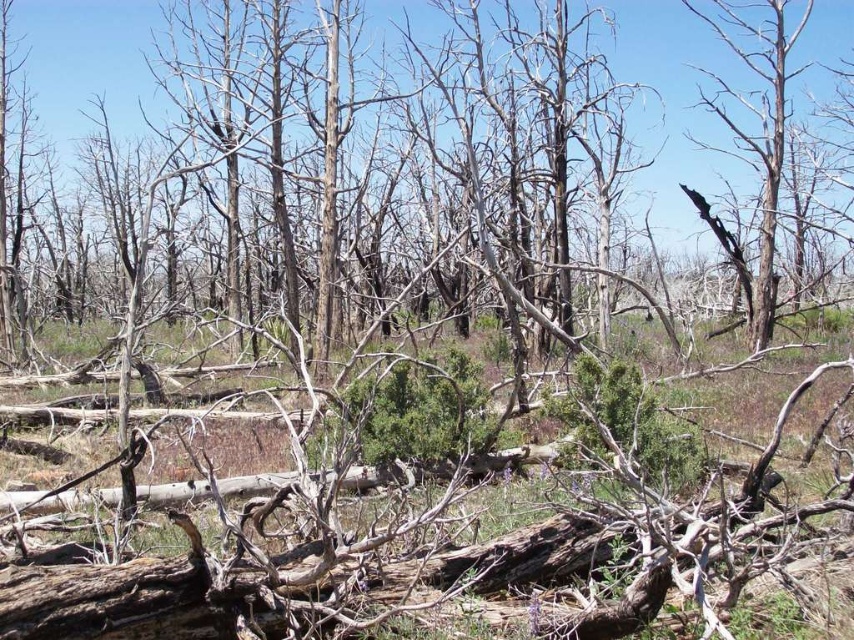
Question: Among these points, which one is farthest from the camera?

Choices:
 (A) (390, 12)
 (B) (773, 173)

Answer: (A)

Question: Where is dead wood at center located in relation to charred wood tree at right in the image?

Choices:
 (A) right
 (B) left

Answer: (B)

Question: Which point is farther to the camera?

Choices:
 (A) charred wood tree at right
 (B) dead wood at center

Answer: (B)

Question: Is dead wood at center wider than charred wood tree at right?

Choices:
 (A) no
 (B) yes

Answer: (B)

Question: Which of the following is the closest to the observer?

Choices:
 (A) (763, 204)
 (B) (652, 188)

Answer: (A)

Question: Can you confirm if dead wood at center is positioned to the left of charred wood tree at right?

Choices:
 (A) yes
 (B) no

Answer: (A)